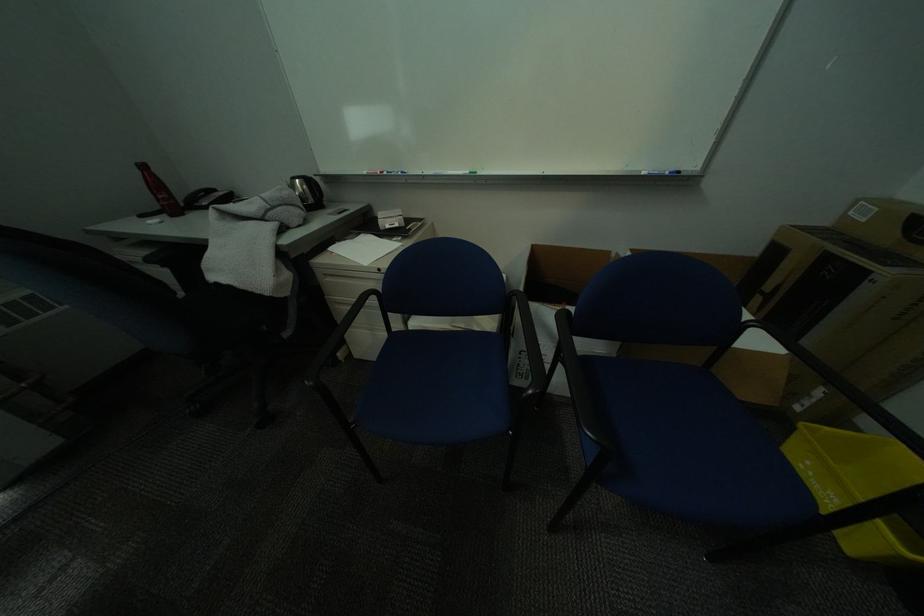
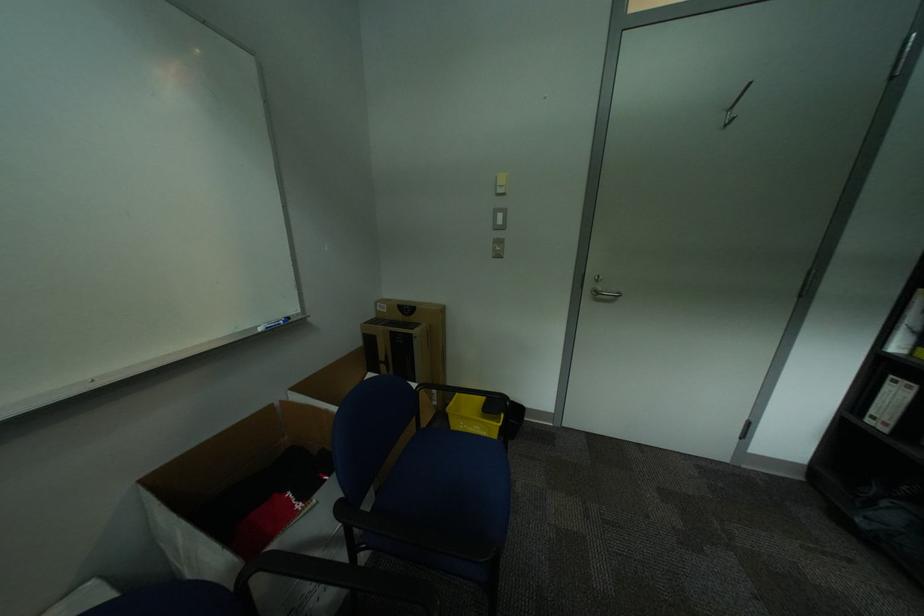
Find the pixel in the second image that matches (x=839, y=430) in the first image.

(463, 405)